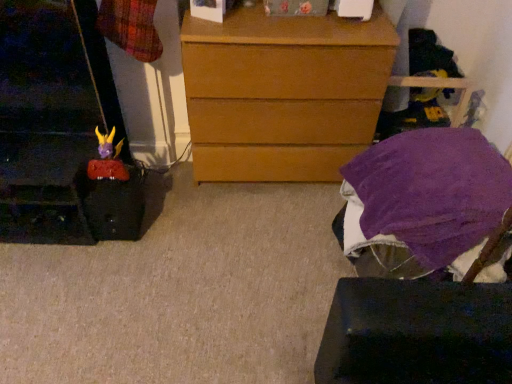
Where is `wooden chest of drawers at center`? The height and width of the screenshot is (384, 512). wooden chest of drawers at center is located at coordinates (283, 93).

This screenshot has height=384, width=512. I want to click on purple soft fabric at lower right, so click(x=432, y=190).

What do you see at coordinates (432, 190) in the screenshot?
I see `purple soft fabric at lower right` at bounding box center [432, 190].

At what (x,y) coordinates should I click in order to perform the action: click on purple fabric-covered stool at lower right. Please return your answer as a coordinate pair (x, y). Looking at the image, I should click on (426, 196).

From the image's perspective, is wooden chest of drawers at center positioned above or below purple soft fabric at lower right?

Based on their image positions, wooden chest of drawers at center is located above purple soft fabric at lower right.

Considering the sizes of objects wooden chest of drawers at center and purple soft fabric at lower right in the image provided, who is bigger, wooden chest of drawers at center or purple soft fabric at lower right?

Bigger between the two is wooden chest of drawers at center.

Is wooden chest of drawers at center positioned with its back to purple soft fabric at lower right?

wooden chest of drawers at center is not turned away from purple soft fabric at lower right.

Is matte plastic toy at left spatially inside wooden chest of drawers at center, or outside of it?

The correct answer is: outside.

Considering the positions of objects matte plastic toy at left and wooden chest of drawers at center in the image provided, who is in front, matte plastic toy at left or wooden chest of drawers at center?

wooden chest of drawers at center.

Consider the image. Considering the relative sizes of matte plastic toy at left and wooden chest of drawers at center in the image provided, is matte plastic toy at left thinner than wooden chest of drawers at center?

Yes, matte plastic toy at left is thinner than wooden chest of drawers at center.

From the image's perspective, between matte plastic toy at left and wooden chest of drawers at center, who is located below?

From the image's view, matte plastic toy at left is below.

Which point is more distant from viewer, (230, 166) or (94, 168)?

The point (230, 166) is farther from the camera.

From the image's perspective, which is below, wooden chest of drawers at center or matte plastic toy at left?

From the image's view, matte plastic toy at left is below.

How distant is wooden chest of drawers at center from matte plastic toy at left?

The distance of wooden chest of drawers at center from matte plastic toy at left is 66.74 centimeters.

Are purple soft fabric at lower right and matte plastic toy at left beside each other?

No.

This screenshot has width=512, height=384. I want to click on toy that appears behind the purple soft fabric at lower right, so click(x=106, y=159).

Is point (392, 223) closer or farther from the camera than point (185, 50)?

Point (392, 223) is closer to the camera than point (185, 50).

Does purple soft fabric at lower right have a greater width compared to wooden chest of drawers at center?

Yes.

Between purple soft fabric at lower right and wooden chest of drawers at center, which one appears on the right side from the viewer's perspective?

Positioned to the right is purple soft fabric at lower right.

From the image's perspective, is purple soft fabric at lower right above wooden chest of drawers at center?

No, from the image's perspective, purple soft fabric at lower right is not over wooden chest of drawers at center.

Between matte plastic toy at left and purple fabric-covered stool at lower right, which one has less height?

Standing shorter between the two is matte plastic toy at left.

Is matte plastic toy at left outside of purple fabric-covered stool at lower right?

Indeed, matte plastic toy at left is completely outside purple fabric-covered stool at lower right.

How many degrees apart are the facing directions of matte plastic toy at left and purple fabric-covered stool at lower right?

92.6 degrees separate the facing orientations of matte plastic toy at left and purple fabric-covered stool at lower right.

Is matte plastic toy at left aimed at purple fabric-covered stool at lower right?

No, matte plastic toy at left is not turned towards purple fabric-covered stool at lower right.

Which object is thinner, wooden chest of drawers at center or purple fabric-covered stool at lower right?

wooden chest of drawers at center is thinner.

Who is more distant, wooden chest of drawers at center or purple fabric-covered stool at lower right?

wooden chest of drawers at center is behind.

Considering the sizes of objects wooden chest of drawers at center and purple fabric-covered stool at lower right in the image provided, who is shorter, wooden chest of drawers at center or purple fabric-covered stool at lower right?

Standing shorter between the two is purple fabric-covered stool at lower right.

Do you think wooden chest of drawers at center is within purple fabric-covered stool at lower right, or outside of it?

wooden chest of drawers at center cannot be found inside purple fabric-covered stool at lower right.

At what (x,y) coordinates should I click in order to perform the action: click on the chest of drawers lying behind the purple soft fabric at lower right. Please return your answer as a coordinate pair (x, y). Looking at the image, I should click on (283, 93).

Find the location of a particular element. the chest of drawers that is in front of the matte plastic toy at left is located at coordinates (283, 93).

Estimate the real-world distances between objects in this image. Which object is closer to wooden chest of drawers at center, purple fabric-covered stool at lower right or matte plastic toy at left?

Based on the image, purple fabric-covered stool at lower right appears to be nearer to wooden chest of drawers at center.

Looking at the image, which one is located further to purple soft fabric at lower right, wooden chest of drawers at center or matte plastic toy at left?

matte plastic toy at left is positioned further to the anchor purple soft fabric at lower right.

Based on their spatial positions, is purple fabric-covered stool at lower right or wooden chest of drawers at center closer to purple soft fabric at lower right?

purple fabric-covered stool at lower right lies closer to purple soft fabric at lower right than the other object.

Based on their spatial positions, is matte plastic toy at left or wooden chest of drawers at center closer to purple fabric-covered stool at lower right?

wooden chest of drawers at center is positioned closer to the anchor purple fabric-covered stool at lower right.

Which object lies nearer to the anchor point purple fabric-covered stool at lower right, matte plastic toy at left or purple soft fabric at lower right?

The object closer to purple fabric-covered stool at lower right is purple soft fabric at lower right.

Which object lies nearer to the anchor point purple soft fabric at lower right, wooden chest of drawers at center or purple fabric-covered stool at lower right?

purple fabric-covered stool at lower right.

Considering their positions, is purple soft fabric at lower right positioned closer to wooden chest of drawers at center than purple fabric-covered stool at lower right?

The object closer to wooden chest of drawers at center is purple fabric-covered stool at lower right.

Based on their spatial positions, is purple fabric-covered stool at lower right or matte plastic toy at left closer to purple soft fabric at lower right?

purple fabric-covered stool at lower right is closer to purple soft fabric at lower right.

The height and width of the screenshot is (384, 512). Identify the location of chest of drawers between matte plastic toy at left and purple soft fabric at lower right in the horizontal direction. (283, 93).

This screenshot has width=512, height=384. I want to click on furniture between matte plastic toy at left and purple soft fabric at lower right, so click(426, 196).

Find the location of a particular element. chest of drawers between matte plastic toy at left and purple fabric-covered stool at lower right is located at coordinates (283, 93).

This screenshot has width=512, height=384. In order to click on furniture situated between wooden chest of drawers at center and purple soft fabric at lower right from left to right in this screenshot , I will do pyautogui.click(x=426, y=196).